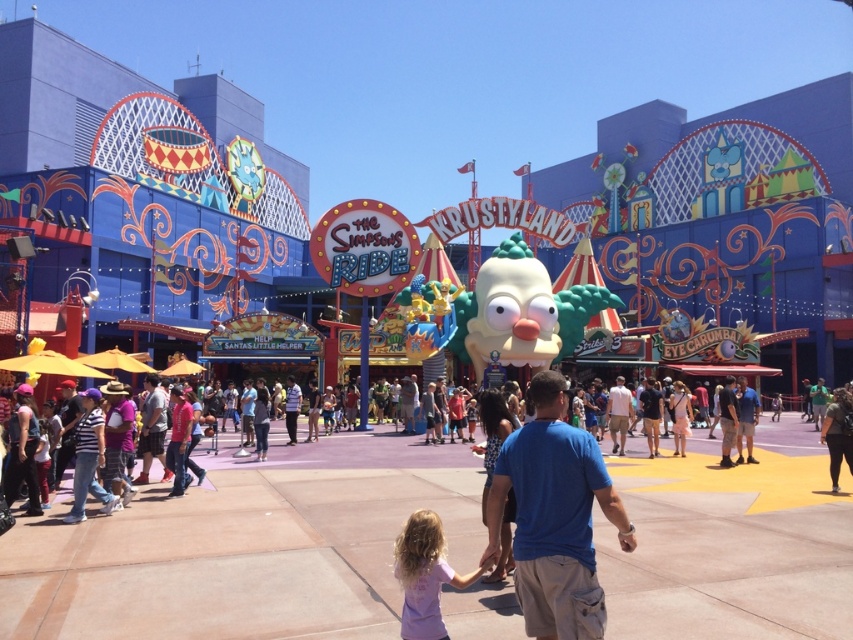
Question: Which point is closer to the camera taking this photo?

Choices:
 (A) (425, 509)
 (B) (163, 468)
 (C) (622, 412)

Answer: (A)

Question: Which of the following is the closest to the observer?

Choices:
 (A) (154, 406)
 (B) (293, 417)

Answer: (A)

Question: Can you confirm if blue cotton t-shirt at center is thinner than light blue shirt at center?

Choices:
 (A) yes
 (B) no

Answer: (B)

Question: Can you confirm if dark blue shirt at center is positioned below blue denim jeans at center?

Choices:
 (A) yes
 (B) no

Answer: (A)

Question: Which point is farther to the camera?

Choices:
 (A) pos(149,413)
 (B) pos(425,570)

Answer: (A)

Question: Is blue cotton t-shirt at center above striped shirt at center?

Choices:
 (A) no
 (B) yes

Answer: (A)